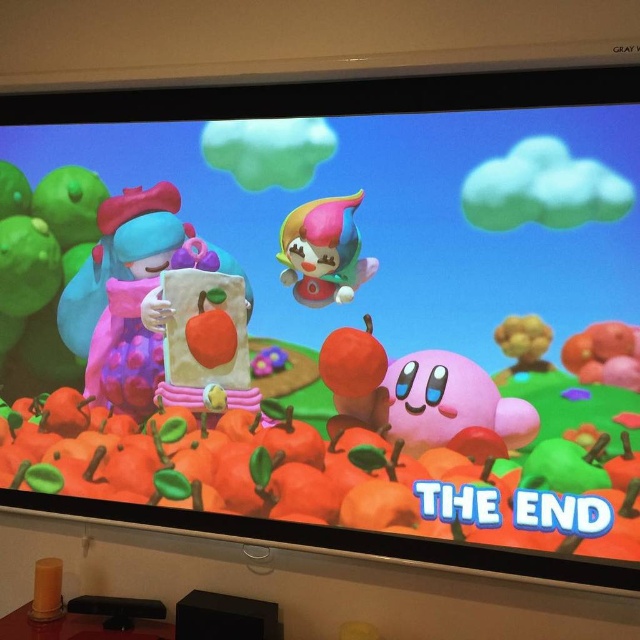
In the scene shown: You are a character in the game who wants to pick up the wooden toy at right without touching the matte pink plush at left. Is this possible?

The matte pink plush at left is located above the wooden toy at right, so you can reach the wooden toy at right without touching the matte pink plush at left by moving underneath it.

You are a character in this Kirby game scene. You want to move from the point at the bottom of the screen to the top. Which point should you move towards to reach the top first? The point at the bottom is either point at (205, 273) or point at (300, 228). Which one is lower on the screen?

Point at (300, 228) is lower on the screen than point at (205, 273) because it has a higher y coordinate value.

You are playing a game and need to collect items. There are two points marked in the scene. The first point is at coordinate point (170, 250) and the second is at point (508, 337). Which point is closer to you, the player?

Point (170, 250) is closer to you because it is further to the camera than point (508, 337).